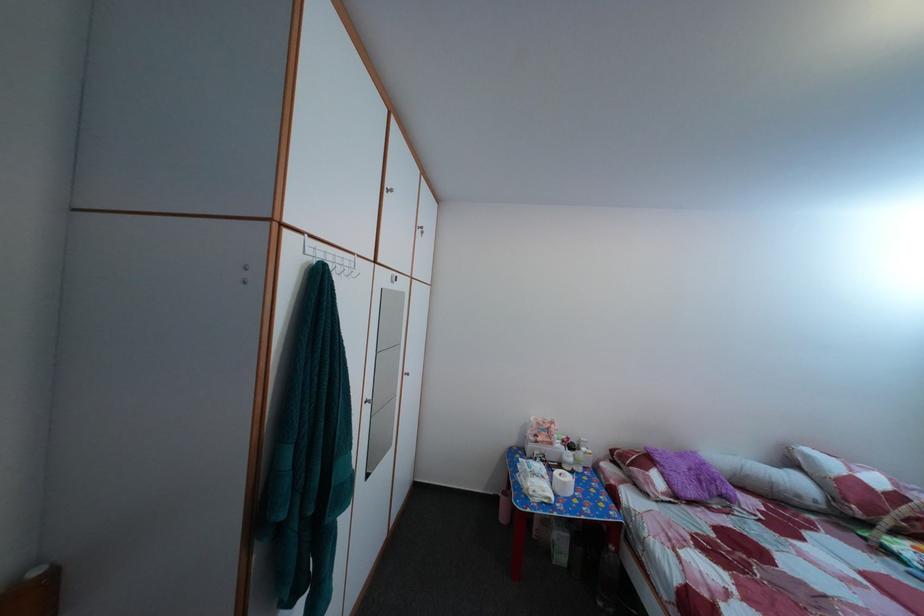
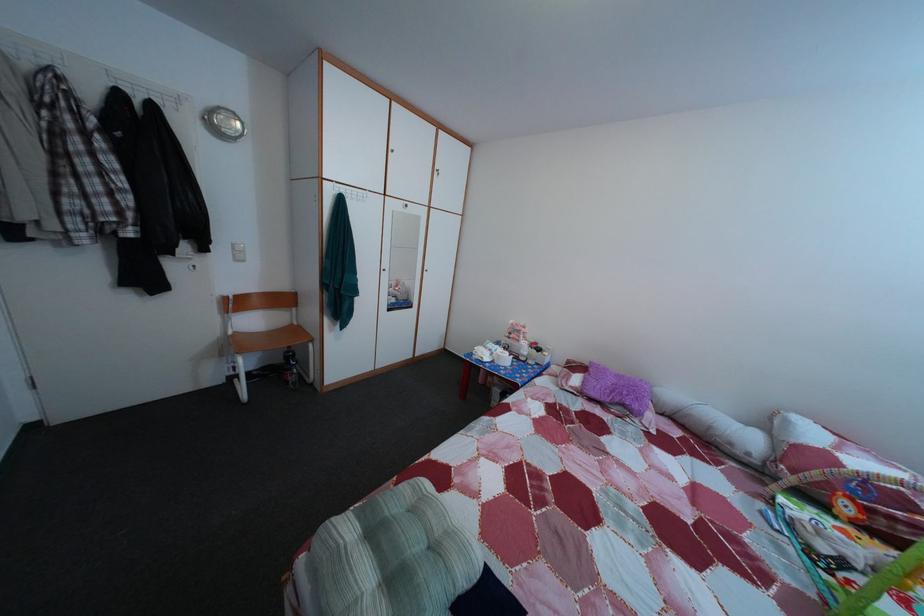
The point at (726, 508) is marked in the first image. Where is the corresponding point in the second image?

(628, 416)